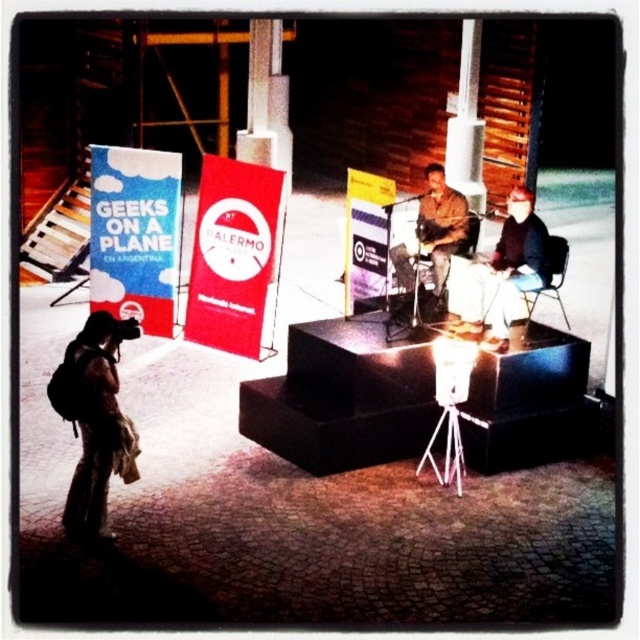
Does brown backpack at lower left come behind leather jacket at center?

No, brown backpack at lower left is in front of leather jacket at center.

Who is more distant from viewer, (100,362) or (426,198)?

Positioned behind is point (426,198).

Locate an element on the screen. brown backpack at lower left is located at coordinates (93, 419).